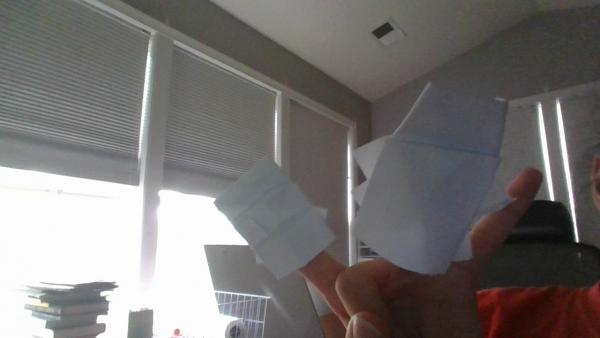
I want to click on white window blinds, so click(98, 136), click(203, 153), click(315, 155).